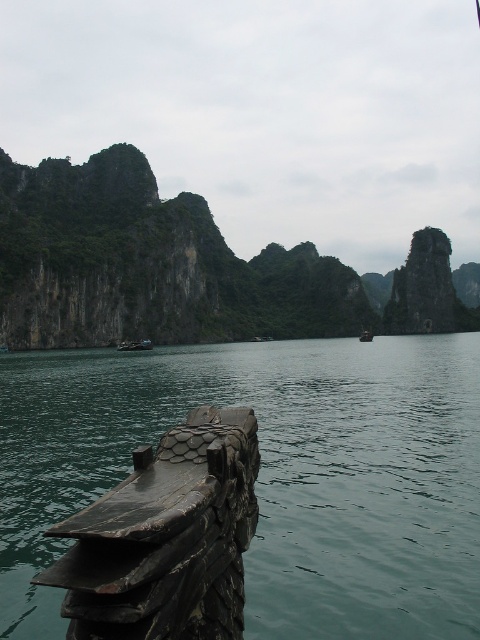
You are standing at the center of the image and want to reach the greenish water at lower left. Which direction should you move in to get there?

To reach the greenish water at lower left, you should move towards the lower left direction since its 2D location is at point (269, 474).

You are a tourist standing at point A located at coordinates (182,268). You want to take a photo of the green rock formation at center. Is the green rock formation at center visible from your current position?

Yes, the green rock formation at center is located exactly at your current position at point A, so you are standing right on top of it. Therefore, you won not be able to see it from your current vantage point.